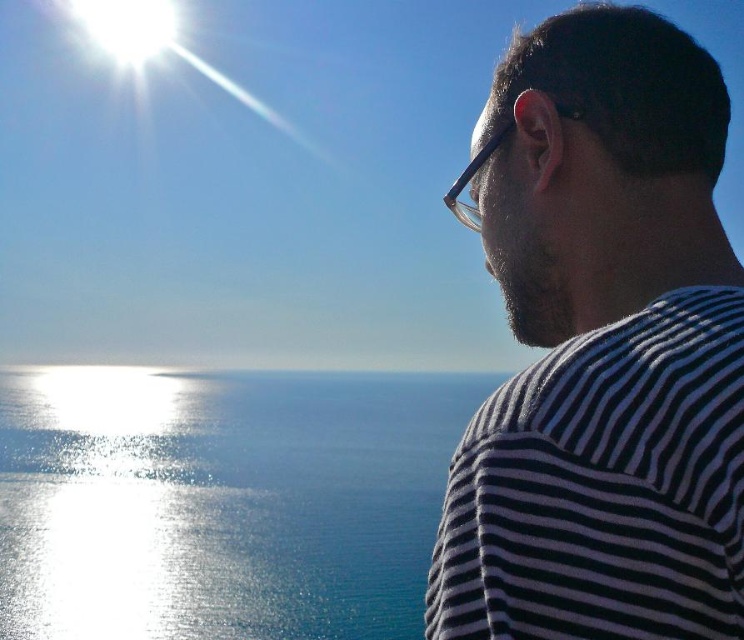
Question: Which point is farther to the camera?

Choices:
 (A) (315, 378)
 (B) (612, 353)

Answer: (A)

Question: Considering the relative positions of black striped shirt at right and glistening blue water at center in the image provided, where is black striped shirt at right located with respect to glistening blue water at center?

Choices:
 (A) right
 (B) left

Answer: (A)

Question: Which point is farther to the camera?

Choices:
 (A) black striped shirt at right
 (B) glistening blue water at center

Answer: (B)

Question: Does black striped shirt at right appear on the left side of glistening blue water at center?

Choices:
 (A) yes
 (B) no

Answer: (B)

Question: Which point is farther to the camera?

Choices:
 (A) (368, 627)
 (B) (632, 230)

Answer: (A)

Question: Does black striped shirt at right lie in front of glistening blue water at center?

Choices:
 (A) yes
 (B) no

Answer: (A)